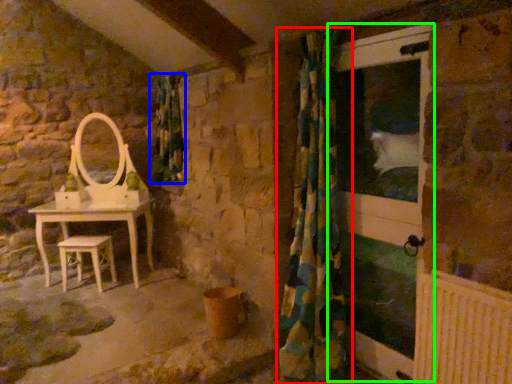
Question: Based on their relative distances, which object is farther from curtain (highlighted by a red box)? Choose from shower curtain (highlighted by a blue box) and screen door (highlighted by a green box).

Choices:
 (A) shower curtain
 (B) screen door

Answer: (A)